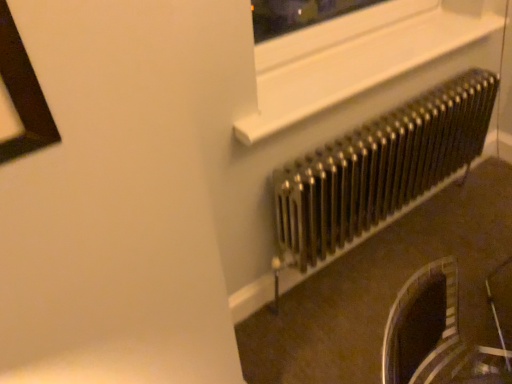
Question: Is metallic radiator at right bigger or smaller than white plastic window frame at upper center?

Choices:
 (A) small
 (B) big

Answer: (B)

Question: From the image's perspective, is metallic radiator at right above or below white plastic window frame at upper center?

Choices:
 (A) above
 (B) below

Answer: (B)

Question: In terms of height, does metallic radiator at right look taller or shorter compared to white plastic window frame at upper center?

Choices:
 (A) tall
 (B) short

Answer: (A)

Question: From a real-world perspective, relative to metallic radiator at right, is white plastic window frame at upper center vertically above or below?

Choices:
 (A) below
 (B) above

Answer: (B)

Question: Considering the positions of white plastic window frame at upper center and metallic radiator at right in the image, is white plastic window frame at upper center taller or shorter than metallic radiator at right?

Choices:
 (A) short
 (B) tall

Answer: (A)

Question: Does point (413, 51) appear closer or farther from the camera than point (483, 91)?

Choices:
 (A) closer
 (B) farther

Answer: (A)

Question: Based on their sizes in the image, would you say white plastic window frame at upper center is bigger or smaller than metallic radiator at right?

Choices:
 (A) small
 (B) big

Answer: (A)